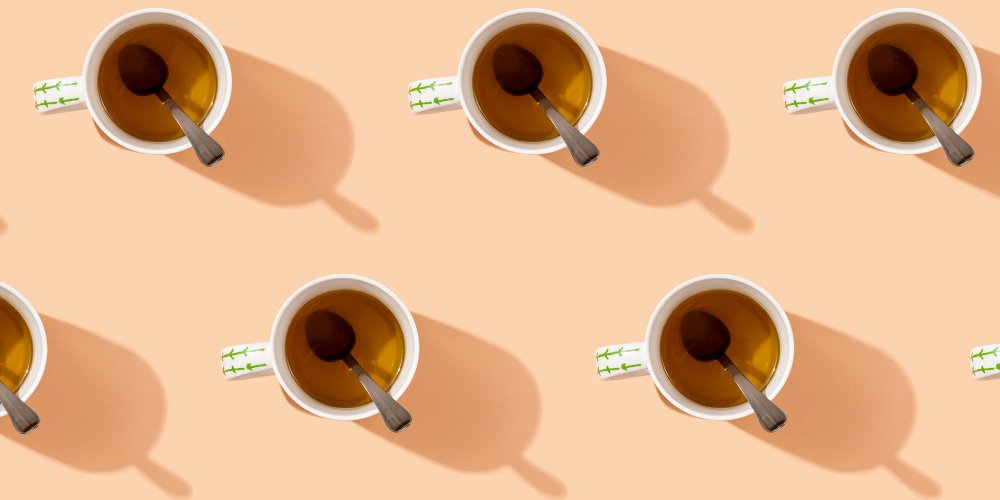
Where is `spoons`? This screenshot has height=500, width=1000. spoons is located at coordinates (151, 75), (17, 409), (334, 342), (509, 65), (716, 327), (892, 70).